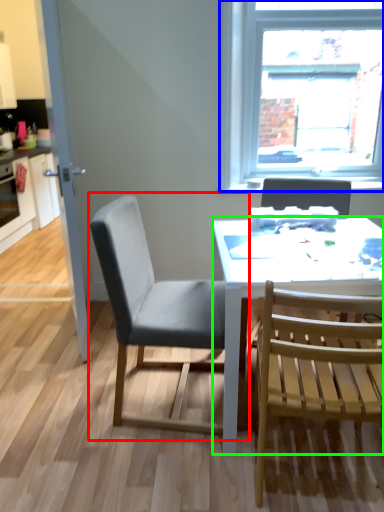
Question: Estimate the real-world distances between objects in this image. Which object is farther from chair (highlighted by a red box), window (highlighted by a blue box) or desk (highlighted by a green box)?

Choices:
 (A) window
 (B) desk

Answer: (A)